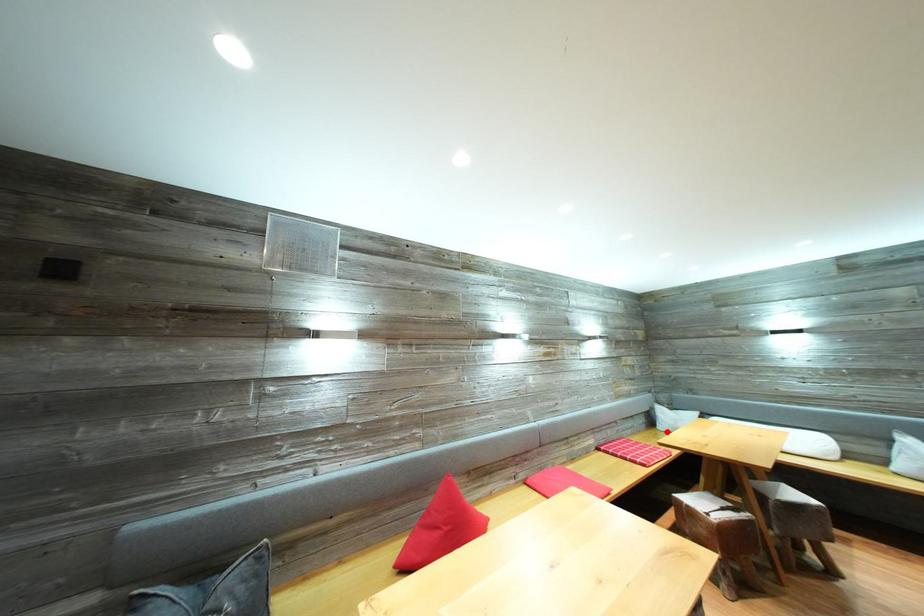
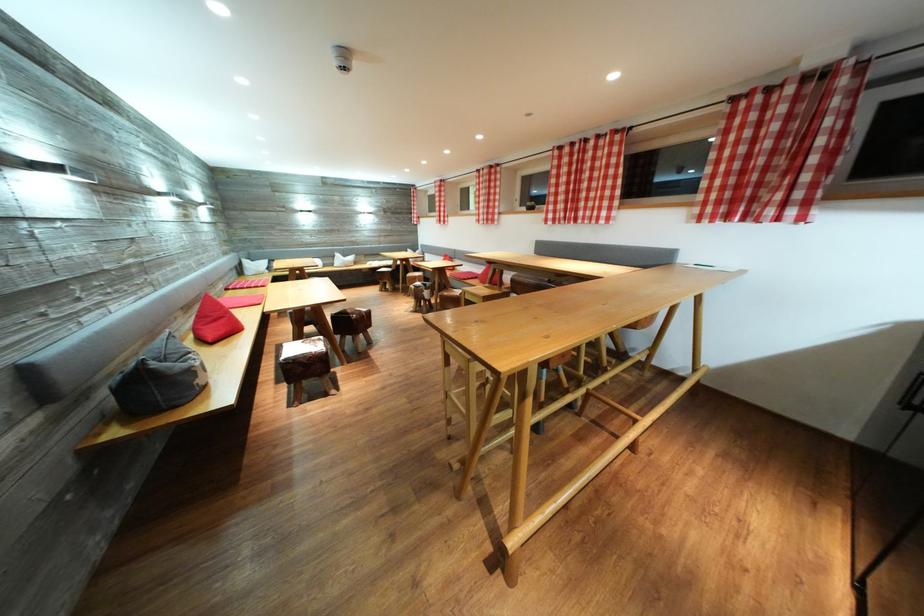
Question: I am providing you with two images of the same scene from different viewpoints. Image1 has a red point marked. In image2, the corresponding 3D location appears at what relative position? Reply with the corresponding letter.

Choices:
 (A) Closer
 (B) Farther

Answer: (A)